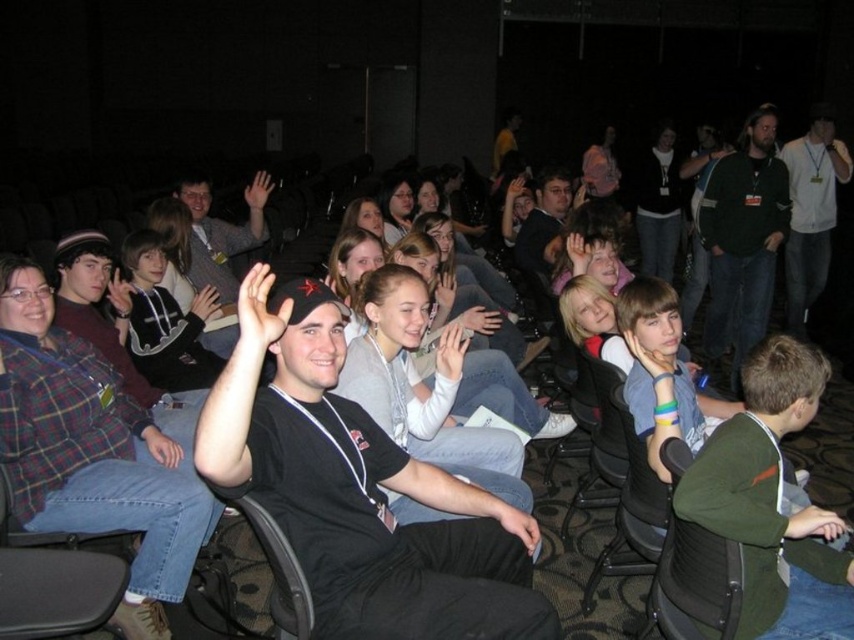
You are standing in the large hall and want to move from point A to point B. Point A is at coordinate point (x=728, y=291) and point B is at coordinate point (x=205, y=196). Which point is closer to you when you first enter the hall?

Point (x=728, y=291) is closer to the viewer than point (x=205, y=196), so when you first enter the hall, point A is closer to you.